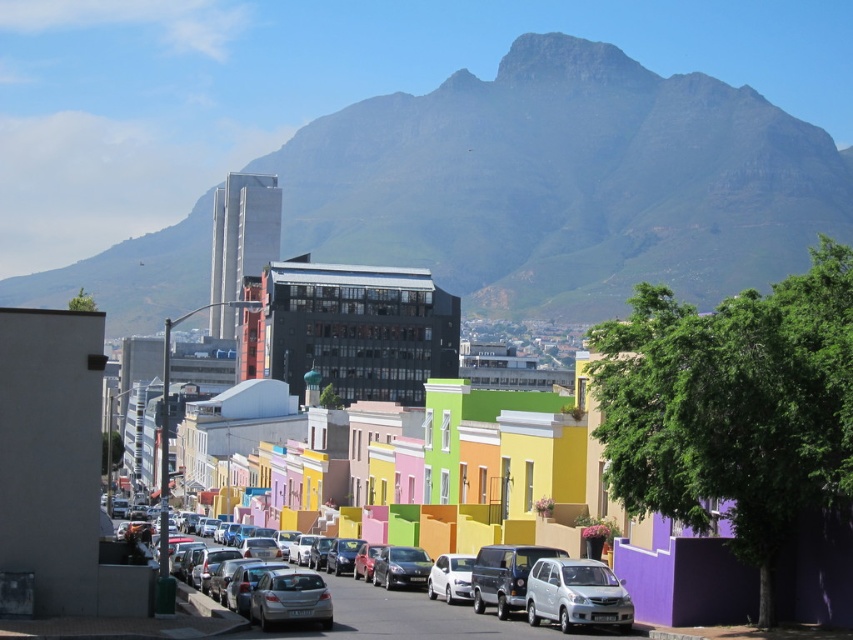
Question: In this image, where is white matte van at center located relative to white glossy car at center?

Choices:
 (A) below
 (B) above

Answer: (B)

Question: Which object is farther from the camera taking this photo?

Choices:
 (A) shiny silver sedan at center
 (B) white matte van at center

Answer: (B)

Question: Observing the image, what is the correct spatial positioning of rugged granite mountain at upper center in reference to shiny silver sedan at center?

Choices:
 (A) right
 (B) left

Answer: (B)

Question: Which object is farther from the camera taking this photo?

Choices:
 (A) white glossy car at center
 (B) shiny silver sedan at center

Answer: (A)

Question: Considering the relative positions of shiny silver sedan at center and white glossy car at center in the image provided, where is shiny silver sedan at center located with respect to white glossy car at center?

Choices:
 (A) above
 (B) below

Answer: (B)

Question: Estimate the real-world distances between objects in this image. Which object is closer to the rugged granite mountain at upper center?

Choices:
 (A) white glossy car at center
 (B) shiny silver sedan at center

Answer: (B)